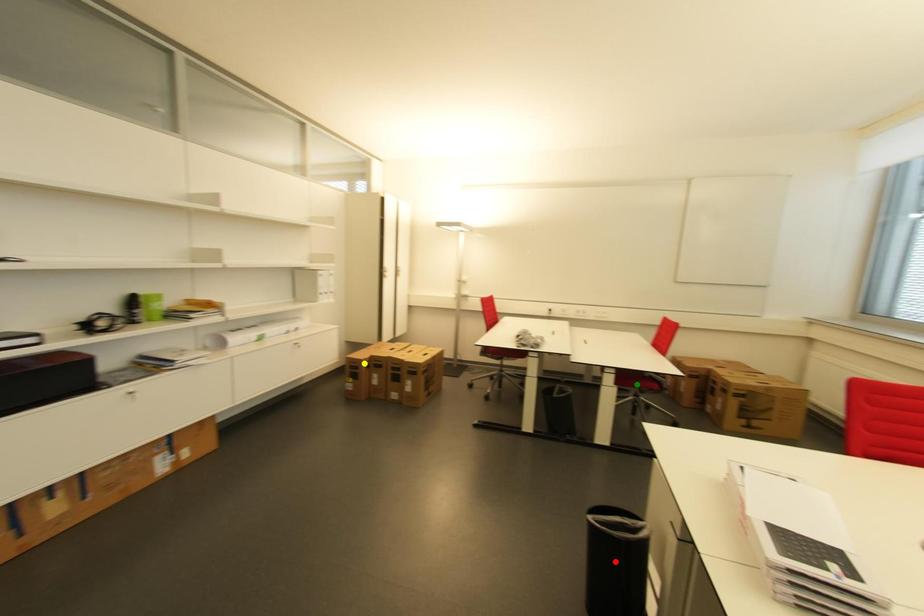
Order these from farthest to nearest:
A) green point
B) red point
C) yellow point

yellow point, green point, red point